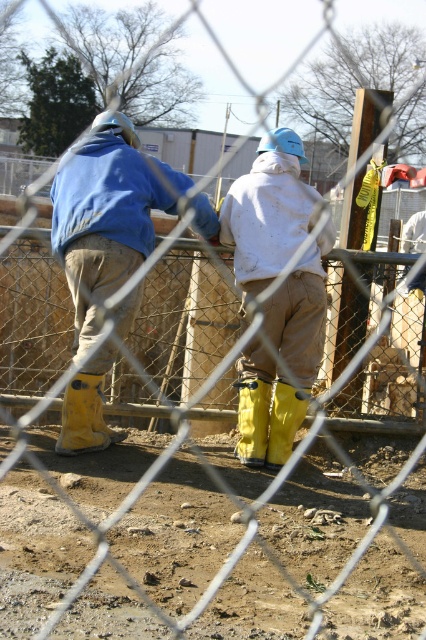
Can you confirm if white matte jacket at center is positioned above yellow rubber boot at center?

Indeed, white matte jacket at center is positioned over yellow rubber boot at center.

Can you confirm if white matte jacket at center is thinner than yellow rubber boot at center?

Incorrect, white matte jacket at center's width is not less than yellow rubber boot at center's.

Is point (307, 321) farther from viewer compared to point (250, 422)?

No, it is not.

Image resolution: width=426 pixels, height=640 pixels. I want to click on white matte jacket at center, so click(x=284, y=358).

Is white matte jacket at center positioned in front of yellow rubber boot at lower center?

Yes, it is in front of yellow rubber boot at lower center.

Who is more forward, [244,193] or [290,422]?

Point [290,422]

The height and width of the screenshot is (640, 426). Find the location of `white matte jacket at center`. white matte jacket at center is located at coordinates (284, 358).

Which of these two, yellow rubber boot at center or yellow rubber boot at lower center, stands shorter?

With less height is yellow rubber boot at center.

Is point (235, 384) less distant than point (299, 401)?

No, it is behind (299, 401).

The height and width of the screenshot is (640, 426). Find the location of `yellow rubber boot at center`. yellow rubber boot at center is located at coordinates (253, 420).